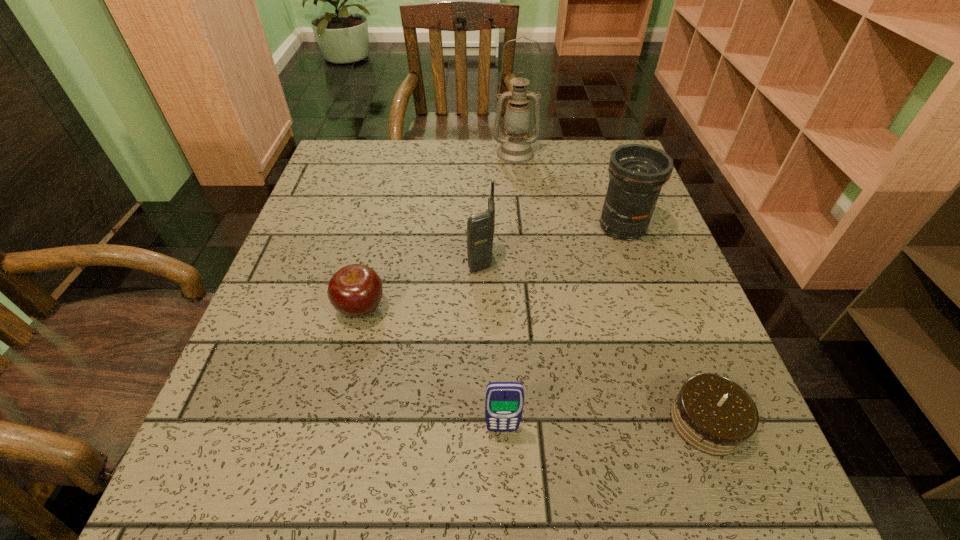
At what (x,y) coordinates should I click in order to perform the action: click on free space located 0.120m on the left of the oil lamp. Please return your answer as a coordinate pair (x, y). The image size is (960, 540). Looking at the image, I should click on (449, 153).

You are a GUI agent. You are given a task and a screenshot of the screen. Output one action in this format:
    pyautogui.click(x=<x>, y=<y>)
    Task: Click on the free space located on the front of the second farthest object
    
    Given the screenshot: What is the action you would take?
    pyautogui.click(x=636, y=267)

The width and height of the screenshot is (960, 540). In order to click on vacant space located on the keyboard of the taller cellular telephone in this screenshot , I will do `click(397, 260)`.

What are the coordinates of `free space located 0.050m on the keyboard of the taller cellular telephone` in the screenshot? It's located at (444, 260).

In order to click on free space located 0.060m on the keyboard of the taller cellular telephone in this screenshot , I will do `click(440, 260)`.

This screenshot has width=960, height=540. I want to click on vacant region located on the front of the third nearest object, so click(324, 460).

Locate an element on the screen. vacant space located on the back of the shortest object is located at coordinates (671, 327).

Locate an element on the screen. This screenshot has width=960, height=540. object that is at the far edge is located at coordinates (516, 148).

You are a GUI agent. You are given a task and a screenshot of the screen. Output one action in this format:
    pyautogui.click(x=<x>, y=<y>)
    Task: Click on the object present at the left edge
    
    Given the screenshot: What is the action you would take?
    pyautogui.click(x=355, y=290)

Find the location of a particular element. The height and width of the screenshot is (540, 960). telephoto lens situated at the right edge is located at coordinates (637, 172).